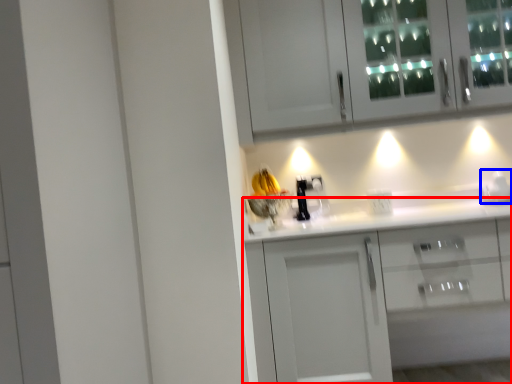
Question: Among these objects, which one is nearest to the camera, cabinetry (highlighted by a red box) or appliance (highlighted by a blue box)?

Choices:
 (A) cabinetry
 (B) appliance

Answer: (A)